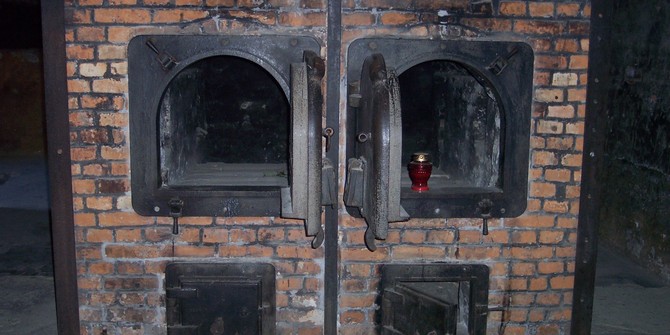
Where is `door`? This screenshot has height=335, width=670. door is located at coordinates (228, 304), (419, 320).